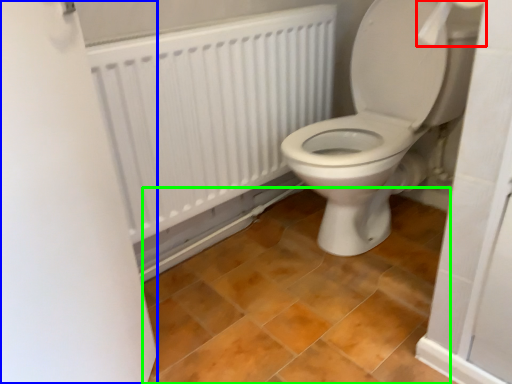
Question: Which is nearer to the toilet paper (highlighted by a red box)? screen door (highlighted by a blue box) or ceramic tile (highlighted by a green box).

Choices:
 (A) screen door
 (B) ceramic tile

Answer: (A)